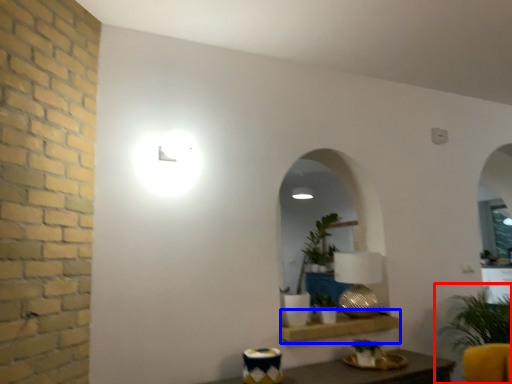
Question: Which of the following is the closest to the observer, houseplant (highlighted by a red box) or shelf (highlighted by a blue box)?

Choices:
 (A) houseplant
 (B) shelf

Answer: (A)